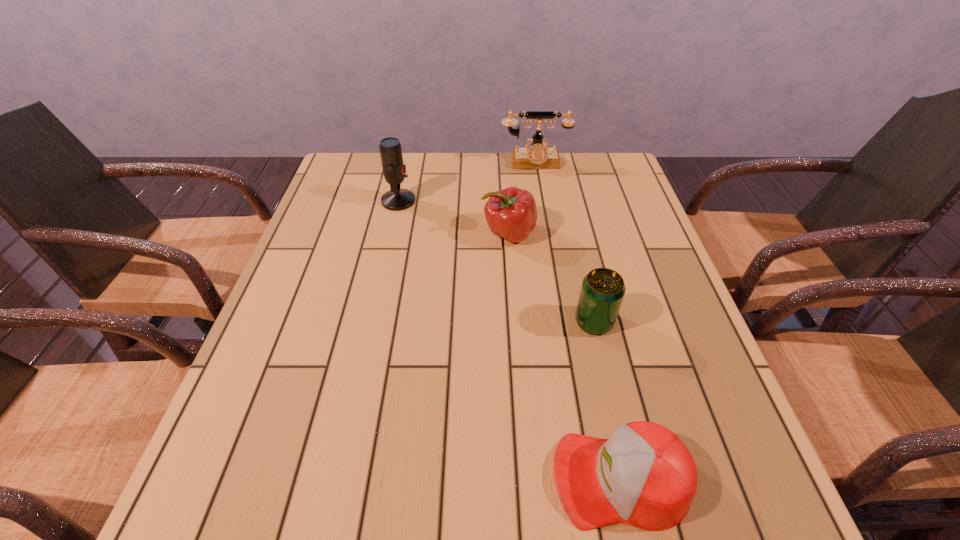
I want to click on vacant space situated on the front of the beer can, so click(609, 383).

Where is `vacant space located on the front-facing side of the shortest object`? The height and width of the screenshot is (540, 960). vacant space located on the front-facing side of the shortest object is located at coordinates (510, 479).

The height and width of the screenshot is (540, 960). In order to click on vacant space located on the front-facing side of the shortest object in this screenshot , I will do `click(400, 479)`.

The height and width of the screenshot is (540, 960). I want to click on vacant point located 0.130m on the front-facing side of the shortest object, so click(473, 479).

This screenshot has height=540, width=960. Identify the location of microphone at the far edge. (394, 170).

Where is `telephone that is at the far edge`? telephone that is at the far edge is located at coordinates pyautogui.click(x=538, y=156).

At what (x,y) coordinates should I click in order to perform the action: click on object present at the near edge. Please return your answer as a coordinate pair (x, y). Looking at the image, I should click on point(643,475).

The width and height of the screenshot is (960, 540). What are the coordinates of `object at the right edge` in the screenshot? It's located at (643, 475).

You are a GUI agent. You are given a task and a screenshot of the screen. Output one action in this format:
    pyautogui.click(x=<x>, y=<y>)
    Task: Click on the object that is at the near right corner
    
    Given the screenshot: What is the action you would take?
    pyautogui.click(x=643, y=475)

You are a GUI agent. You are given a task and a screenshot of the screen. Output one action in this format:
    pyautogui.click(x=<x>, y=<y>)
    Task: Click on the vacant space at the far edge of the desktop
    This screenshot has height=540, width=960.
    Given the screenshot: What is the action you would take?
    pyautogui.click(x=490, y=187)